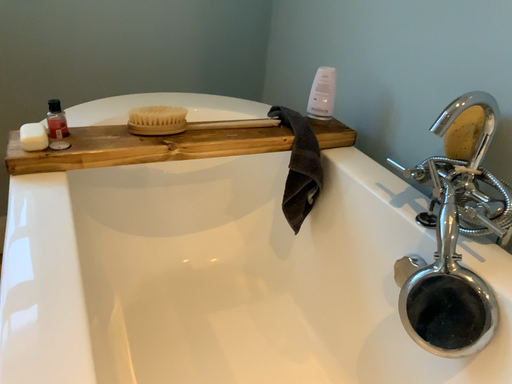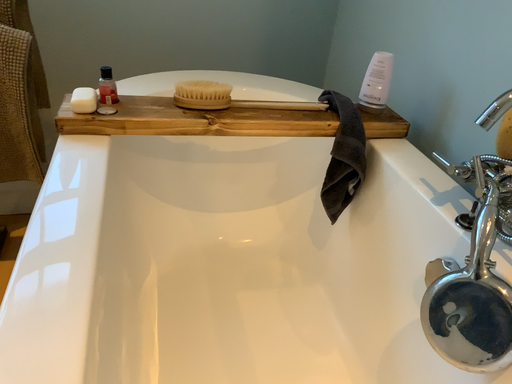
Question: Which way did the camera rotate in the video?

Choices:
 (A) rotated left
 (B) rotated right

Answer: (A)